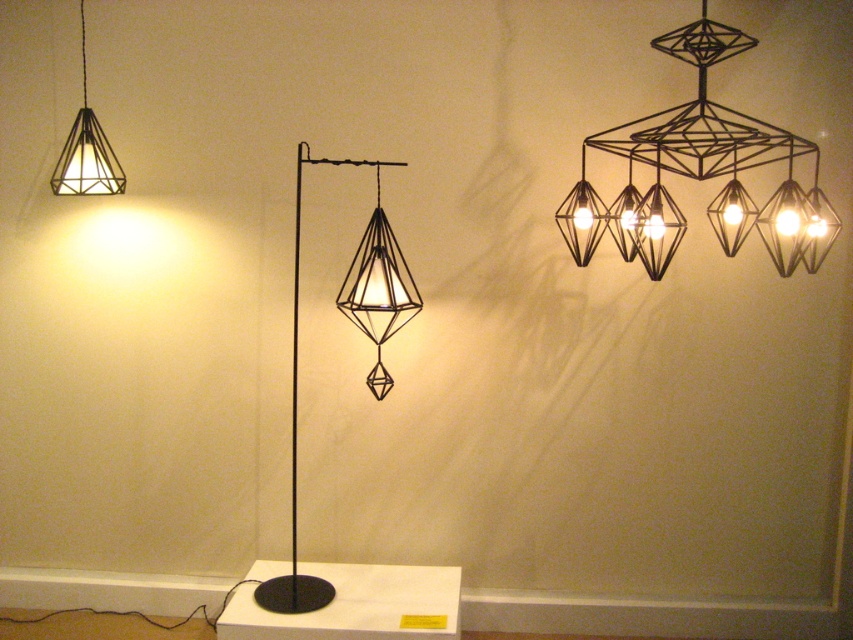
Between matte black floor lamp at center and matte black geometric lamp at upper left, which one has less height?

matte black geometric lamp at upper left is shorter.

Is the position of matte black floor lamp at center more distant than that of matte black geometric lamp at upper left?

No.

Is point (399, 298) in front of point (119, 166)?

Yes.

This screenshot has width=853, height=640. In order to click on matte black floor lamp at center in this screenshot , I will do `click(366, 333)`.

Can you confirm if black wireframe chandelier at upper right is smaller than matte black floor lamp at center?

No, black wireframe chandelier at upper right is not smaller than matte black floor lamp at center.

Describe the element at coordinates (701, 172) in the screenshot. This screenshot has height=640, width=853. I see `black wireframe chandelier at upper right` at that location.

This screenshot has width=853, height=640. I want to click on black wireframe chandelier at upper right, so click(x=701, y=172).

Can you confirm if matte black geometric lamp at center is taller than matte black geometric lamp at upper left?

Correct, matte black geometric lamp at center is much taller as matte black geometric lamp at upper left.

Image resolution: width=853 pixels, height=640 pixels. What do you see at coordinates (378, 291) in the screenshot?
I see `matte black geometric lamp at center` at bounding box center [378, 291].

Is point (399, 284) more distant than point (64, 161)?

That is False.

Locate an element on the screen. The width and height of the screenshot is (853, 640). matte black geometric lamp at center is located at coordinates pos(378,291).